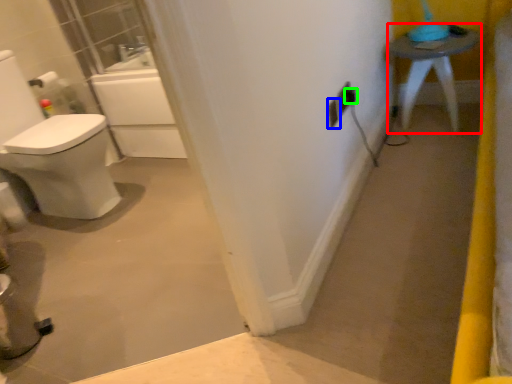
Question: Which is farther away from furniture (highlighted by a red box)? electric outlet (highlighted by a blue box) or electric outlet (highlighted by a green box)?

Choices:
 (A) electric outlet
 (B) electric outlet

Answer: (A)